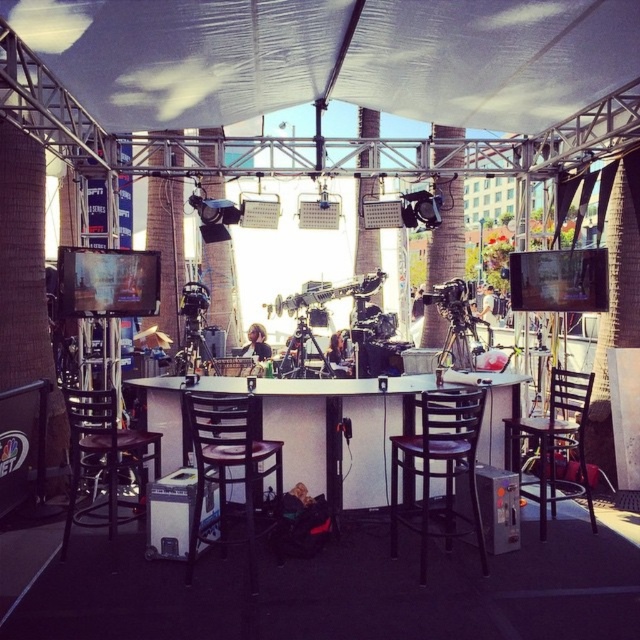
Is black wood chair at right to the right of matte black tripod at center from the viewer's perspective?

Indeed, black wood chair at right is positioned on the right side of matte black tripod at center.

Which is behind, point (576, 404) or point (305, 316)?

The point (305, 316) is behind.

The image size is (640, 640). Find the location of `black wood chair at right`. black wood chair at right is located at coordinates (557, 444).

At what (x,y) coordinates should I click in order to perform the action: click on transparent fabric canopy at center. Please return your answer as a coordinate pair (x, y). Looking at the image, I should click on (332, 56).

Is transparent fabric canopy at center behind black wood chair at right?

That is False.

I want to click on transparent fabric canopy at center, so click(x=332, y=56).

From the picture: Is white laminate table at center to the left of metallic tripod at center from the viewer's perspective?

Incorrect, white laminate table at center is not on the left side of metallic tripod at center.

Can you confirm if white laminate table at center is wider than metallic tripod at center?

Indeed, white laminate table at center has a greater width compared to metallic tripod at center.

Consider the image. Who is more distant from viewer, (x=396, y=412) or (x=186, y=348)?

The point (x=186, y=348) is behind.

You are a GUI agent. You are given a task and a screenshot of the screen. Output one action in this format:
    pyautogui.click(x=<x>, y=<y>)
    Task: Click on the white laminate table at center
    This screenshot has height=640, width=640.
    Given the screenshot: What is the action you would take?
    pyautogui.click(x=337, y=429)